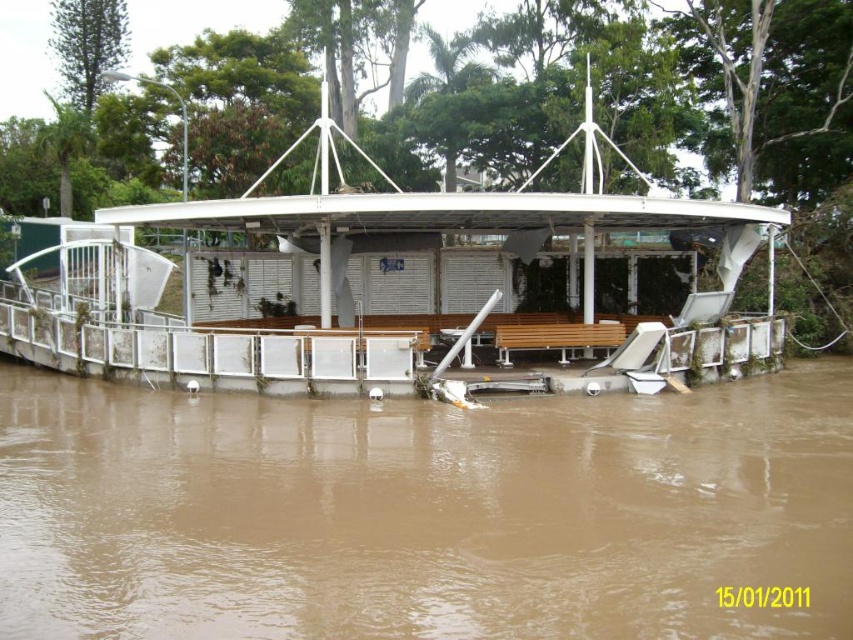
You need to place a small emergency kit on the brown matte wood at center and the wooden bench at center. Which surface has enough space to accommodate the kit without overhanging?

The brown matte wood at center has a larger width than the wooden bench at center, so it can accommodate the emergency kit without overhanging.

You are a rescue worker trying to reach the wooden bench at center inside the flooded structure. You see the white matte boat at center nearby. Can the boat be used to reach the bench without getting out of the water?

The white matte boat at center is taller than the wooden bench at center, so the boat can be used to reach the bench without getting out of the water because it is elevated higher than the bench.